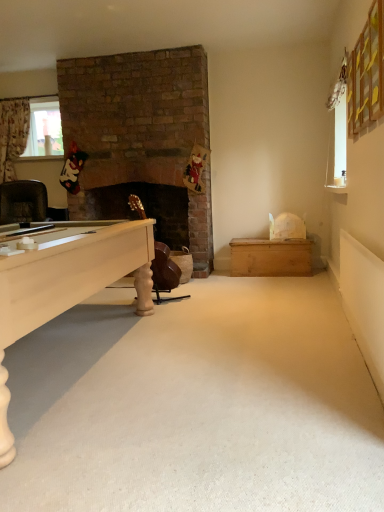
Locate an element on the screen. Image resolution: width=384 pixels, height=512 pixels. clear glass window at upper left is located at coordinates (44, 128).

What is the approximate width of clear glass window at upper left?

clear glass window at upper left is 2.49 inches wide.

What do you see at coordinates (44, 128) in the screenshot? I see `clear glass window at upper left` at bounding box center [44, 128].

The height and width of the screenshot is (512, 384). Identify the location of clear glass window at upper left. (44, 128).